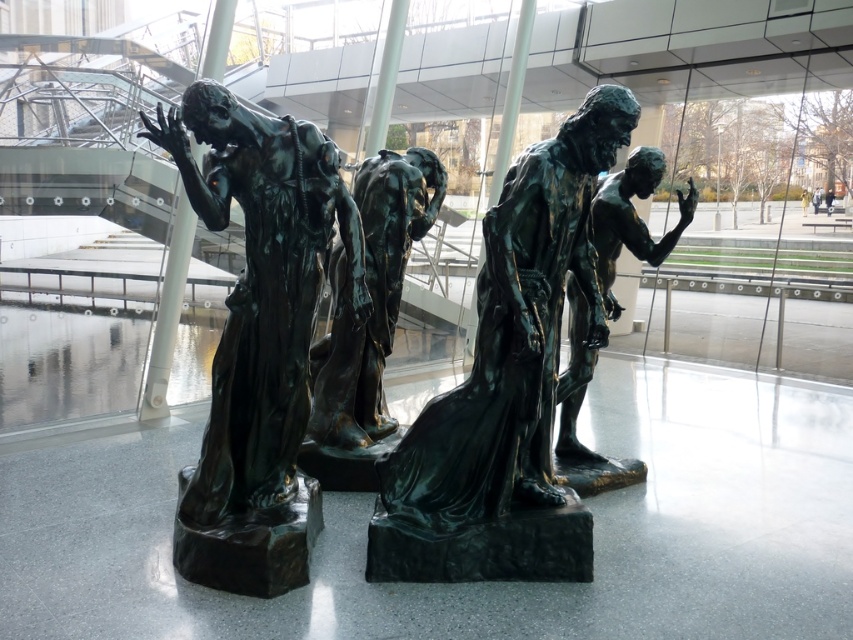
Question: Does bronze statue at center have a lesser width compared to light brown wooden bench at center?

Choices:
 (A) yes
 (B) no

Answer: (B)

Question: Which object is closer to the camera taking this photo?

Choices:
 (A) bronze statue at center
 (B) bronze statue at left
 (C) light brown wooden bench at center

Answer: (B)

Question: Can you confirm if bronze statue at left is positioned to the left of light brown wooden bench at center?

Choices:
 (A) no
 (B) yes

Answer: (B)

Question: Which object is the farthest from the light brown leather jacket at center?

Choices:
 (A) light brown wooden bench at center
 (B) bronze statue at center

Answer: (B)

Question: Observing the image, what is the correct spatial positioning of bronze figure at center in reference to light brown wooden bench at center?

Choices:
 (A) below
 (B) above

Answer: (A)

Question: Which of these objects is positioned closest to the bronze statue at left?

Choices:
 (A) light brown leather jacket at center
 (B) light brown wooden bench at center

Answer: (A)